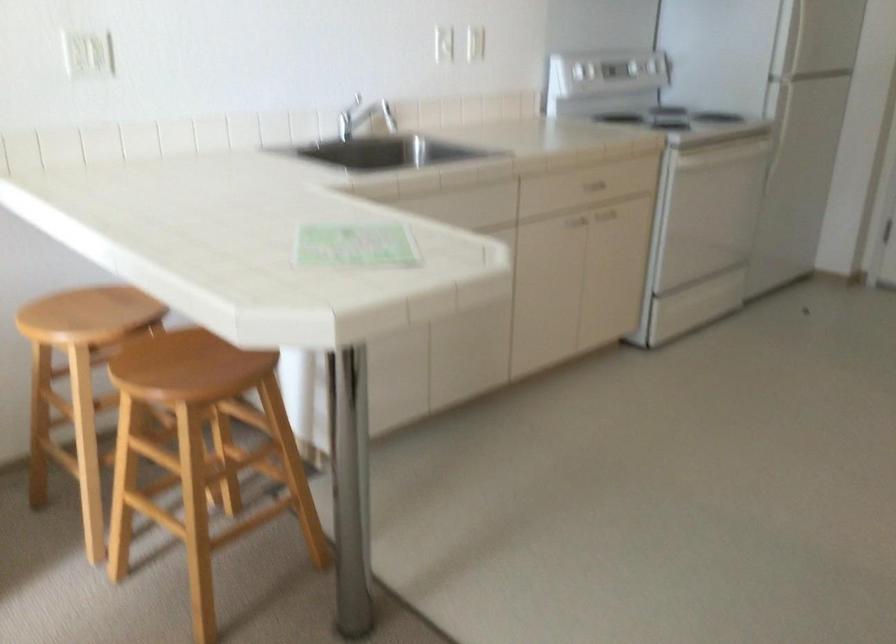
What do you see at coordinates (714, 202) in the screenshot? I see `the oven door handle` at bounding box center [714, 202].